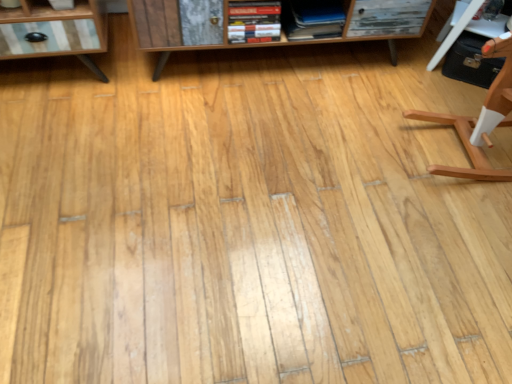
I want to click on blank space to the left of light brown wood rocking chair at right, so click(356, 145).